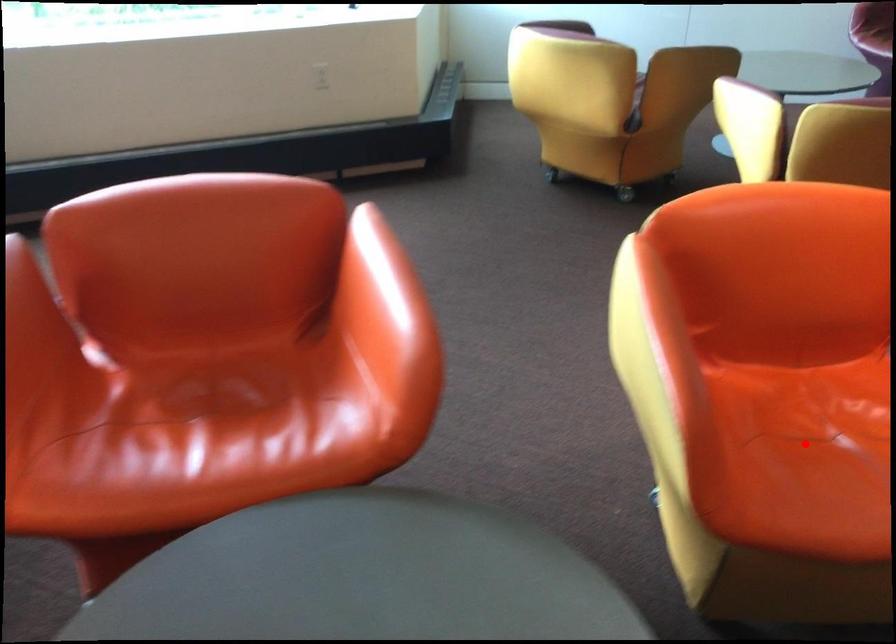
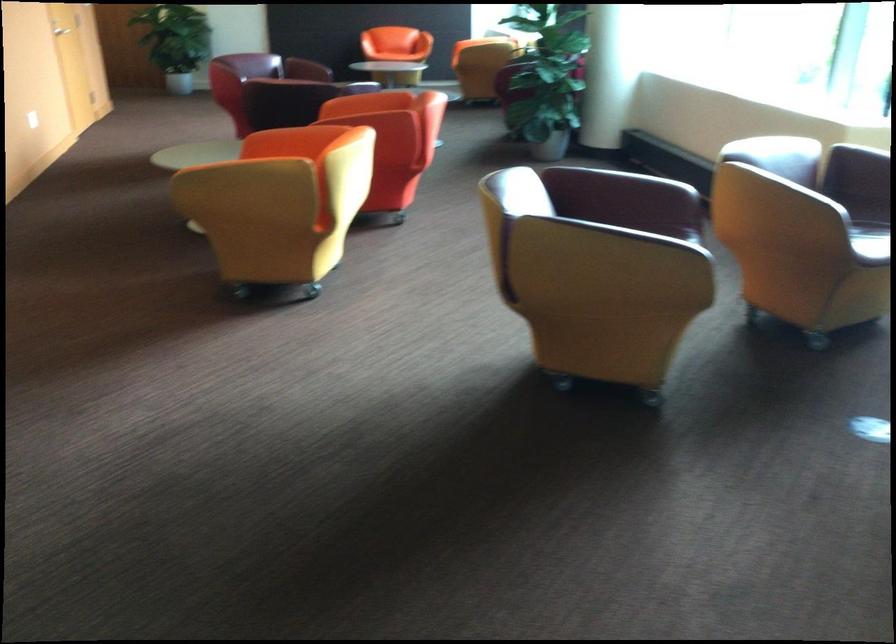
Question: I am providing you with two images of the same scene from different viewpoints. A red point is marked on the first image. Can you still see the location of the red point in image 2?

Choices:
 (A) Yes
 (B) No

Answer: (B)